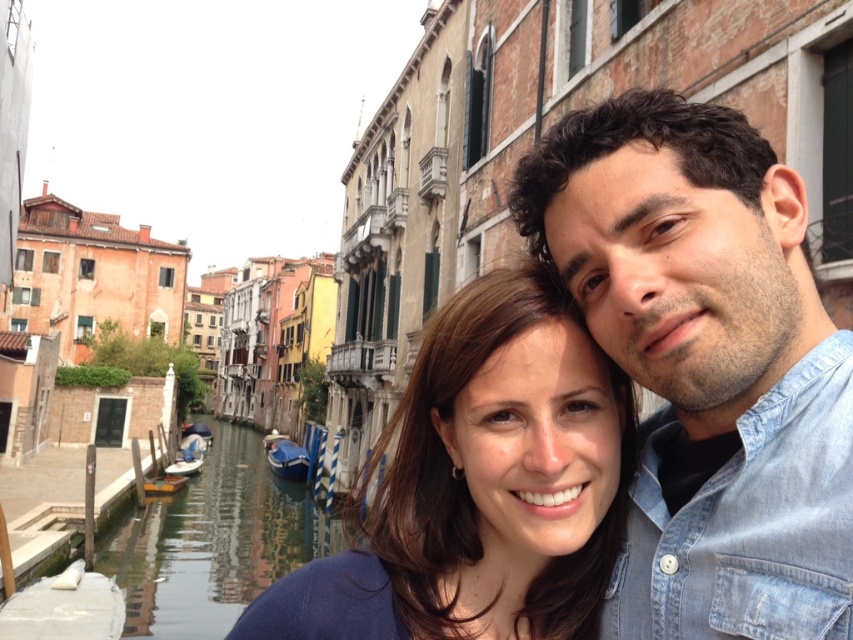
Question: Is blue denim shirt at center further to the viewer compared to white plastic boat at lower left?

Choices:
 (A) yes
 (B) no

Answer: (B)

Question: Which of the following is the closest to the observer?

Choices:
 (A) brown hair at center
 (B) blue denim shirt at center
 (C) smooth water at lower left

Answer: (B)

Question: Which object is closer to the camera taking this photo?

Choices:
 (A) smooth water at lower left
 (B) blue denim shirt at center
 (C) blue glossy boat at lower left

Answer: (B)

Question: Does blue denim shirt at center appear over smooth water at lower left?

Choices:
 (A) yes
 (B) no

Answer: (A)

Question: Which point is closer to the camera?

Choices:
 (A) (200, 440)
 (B) (619, 189)
 (C) (271, 454)

Answer: (B)

Question: Does blue denim shirt at center appear over white plastic boat at lower left?

Choices:
 (A) yes
 (B) no

Answer: (A)